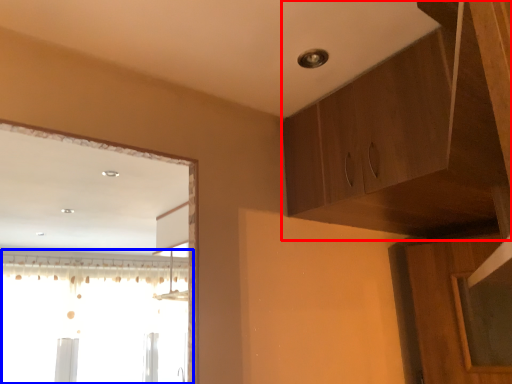
Question: Which of the following is the farthest to the observer, cabinetry (highlighted by a red box) or window (highlighted by a blue box)?

Choices:
 (A) cabinetry
 (B) window

Answer: (B)